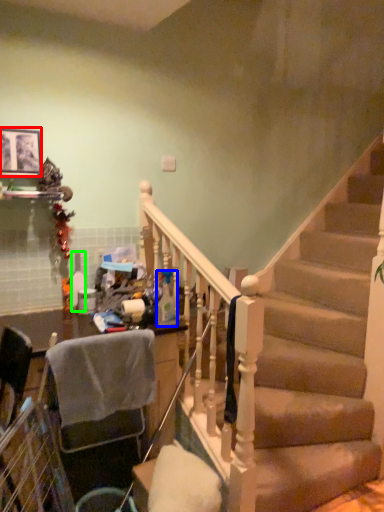
Question: Which object is positioned closest to picture frame (highlighted by a red box)? Select from bottle (highlighted by a blue box) and bottle (highlighted by a green box).

Choices:
 (A) bottle
 (B) bottle

Answer: (B)